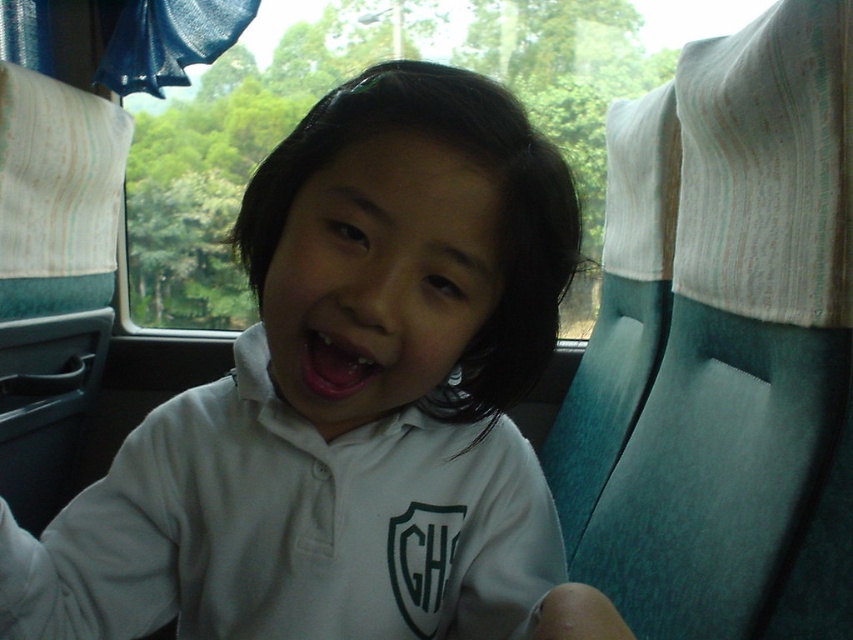
You are a photographer trying to capture the child in the scene. The white matte shirt at center and the pink glossy lips at center are both in focus. Which object would appear more prominent in the photo due to its size?

The white matte shirt at center would appear more prominent in the photo because it has a larger size compared to the pink glossy lips at center.